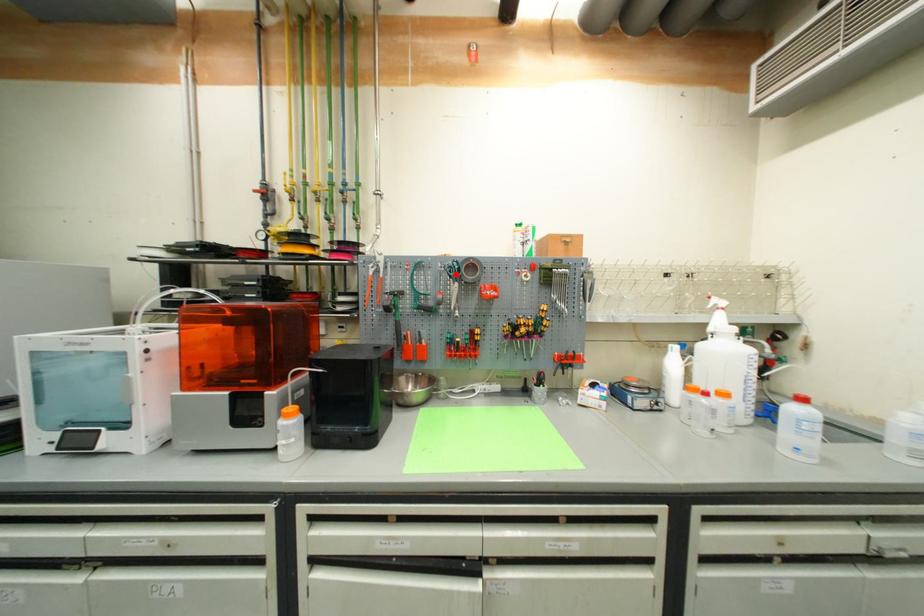
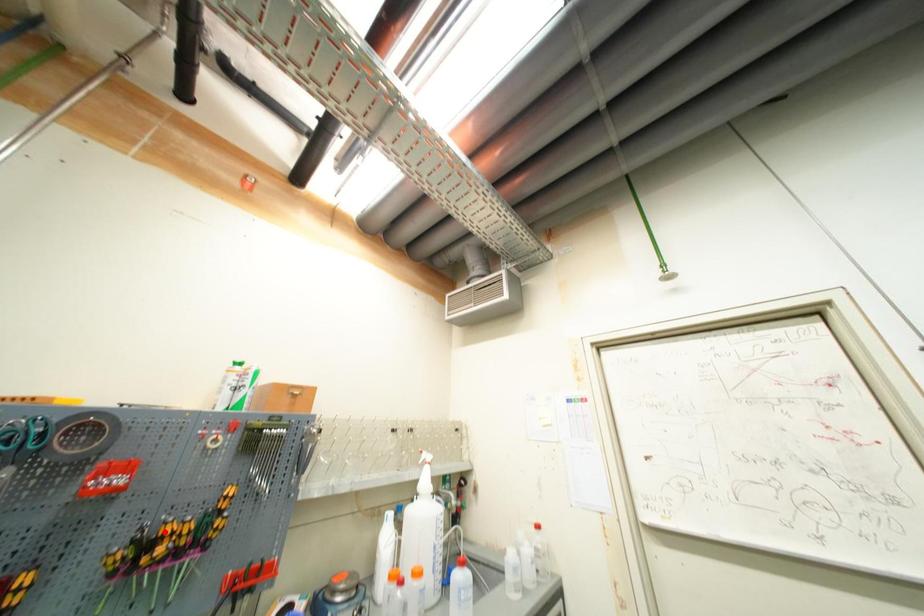
I am providing you with two images of the same scene from different viewpoints. A red point is marked on the first image and another point is marked on the second image. Does the point marked in image1 correspond to the same location as the one in image2?

No